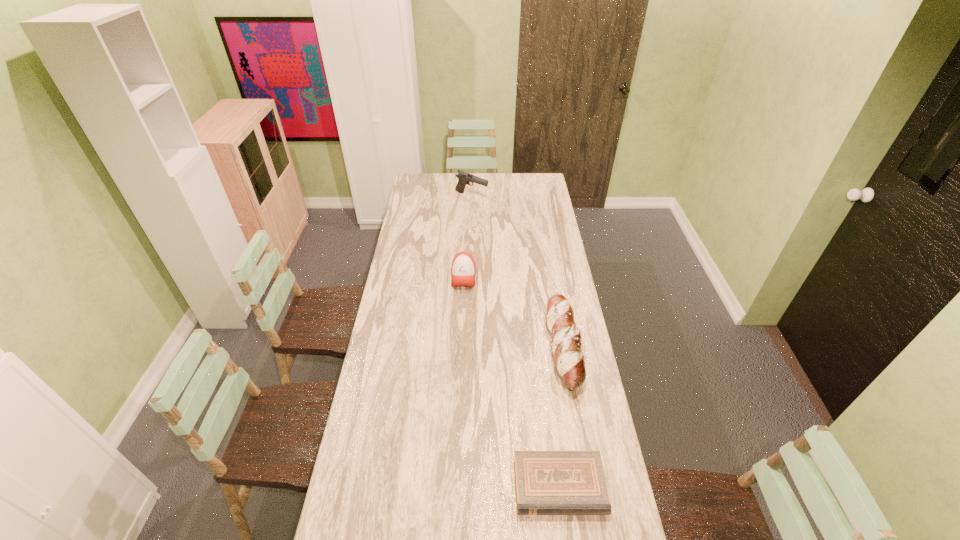
The width and height of the screenshot is (960, 540). Find the location of `empty space between the third nearest object and the second nearest object`. empty space between the third nearest object and the second nearest object is located at coordinates (514, 311).

Locate an element on the screen. Image resolution: width=960 pixels, height=540 pixels. vacant area between the tallest object and the Bible is located at coordinates (516, 341).

Identify the location of vacant point located between the second nearest object and the shortest object. (562, 416).

This screenshot has height=540, width=960. Find the location of `vacant region between the third farthest object and the Bible`. vacant region between the third farthest object and the Bible is located at coordinates (562, 416).

Locate an element on the screen. This screenshot has height=540, width=960. blank region between the gun and the baseball cap is located at coordinates (468, 236).

The image size is (960, 540). Identify the location of object that is the third closest to the nearest object. (464, 178).

Identify which object is the nearest to the farthest object. Please provide its 2D coordinates. Your answer should be formatted as a tuple, i.e. [(x, y)], where the tuple contains the x and y coordinates of a point satisfying the conditions above.

[(463, 265)]

Locate an element on the screen. The image size is (960, 540). blank space that satisfies the following two spatial constraints: 1. on the front-facing side of the second nearest object; 2. on the left side of the second farthest object is located at coordinates coord(461,347).

At what (x,y) coordinates should I click in order to perform the action: click on free location that satisfies the following two spatial constraints: 1. at the muzzle of the tallest object; 2. on the right side of the second nearest object. Please return your answer as a coordinate pair (x, y). This screenshot has height=540, width=960. Looking at the image, I should click on (468, 347).

Identify the location of vacant region that satisfies the following two spatial constraints: 1. on the front-facing side of the baseball cap; 2. on the left side of the baguet. The width and height of the screenshot is (960, 540). (461, 347).